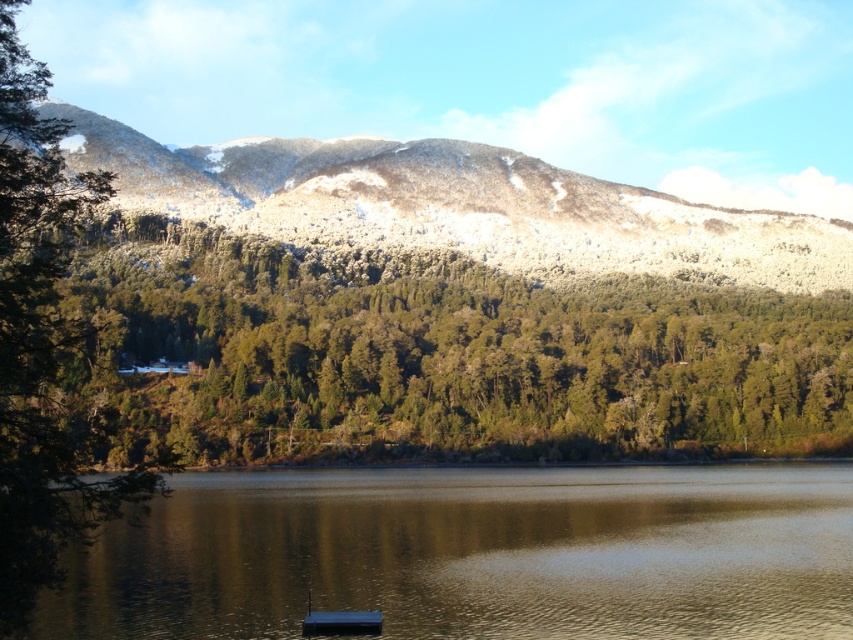
Question: Can you confirm if smooth reflective water at center is wider than metallic blue boat at lower center?

Choices:
 (A) yes
 (B) no

Answer: (A)

Question: Which object is farther from the camera taking this photo?

Choices:
 (A) metallic blue boat at lower center
 (B) snowy forested mountain at upper center

Answer: (B)

Question: Is smooth reflective water at center bigger than metallic blue boat at lower center?

Choices:
 (A) no
 (B) yes

Answer: (B)

Question: Which of these objects is positioned closest to the snowy forested mountain at upper center?

Choices:
 (A) green textured trees at center
 (B) smooth reflective water at center

Answer: (A)

Question: Is green textured trees at center positioned before smooth reflective water at center?

Choices:
 (A) yes
 (B) no

Answer: (A)

Question: Which object is the closest to the smooth reflective water at center?

Choices:
 (A) green textured trees at center
 (B) metallic blue boat at lower center
 (C) snowy forested mountain at upper center

Answer: (B)